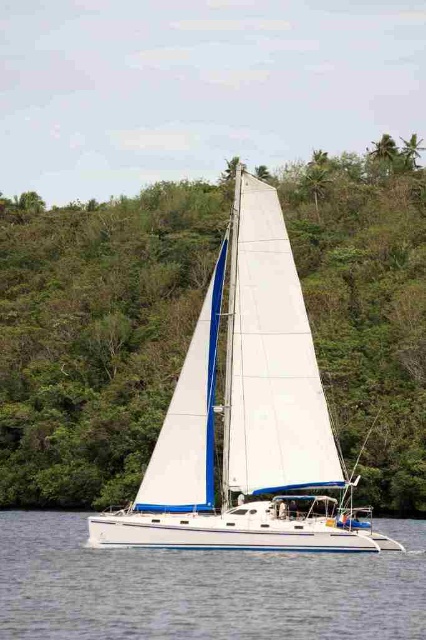
Looking at this image, can you confirm if white matte sailboat at center is positioned below white glossy water at center?

No, white matte sailboat at center is not below white glossy water at center.

Measure the distance between point (244, 269) and camera.

Point (244, 269) is 58.40 meters away from camera.

The width and height of the screenshot is (426, 640). In order to click on white matte sailboat at center in this screenshot , I will do `click(245, 416)`.